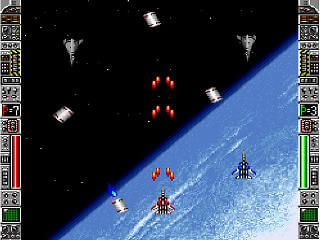
Image resolution: width=320 pixels, height=240 pixels. I want to click on control panels, so click(9, 99), click(308, 110).